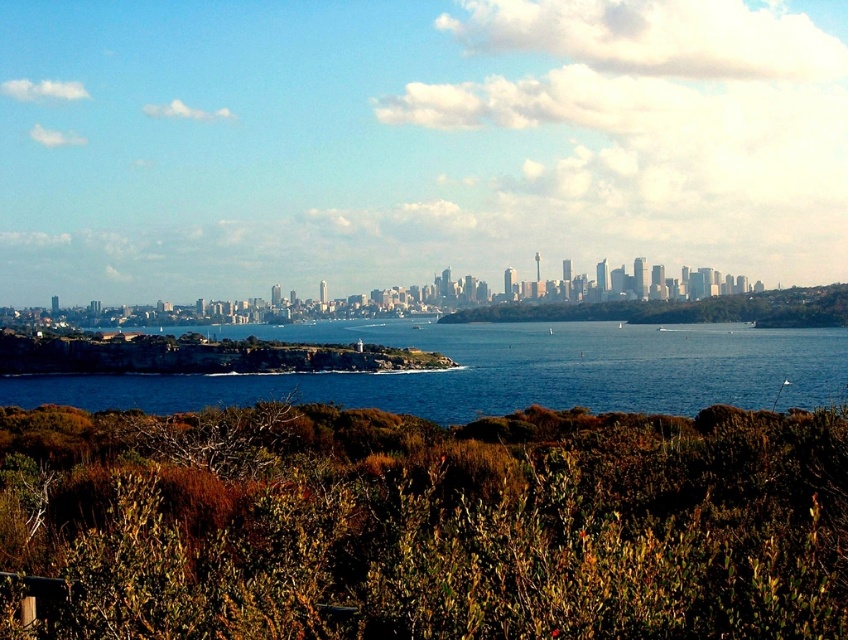
Who is positioned more to the right, green shrubbery at lower center or green leafy shrubs at center?

green leafy shrubs at center is more to the right.

Can you confirm if green shrubbery at lower center is positioned to the left of green leafy shrubs at center?

Correct, you'll find green shrubbery at lower center to the left of green leafy shrubs at center.

Which is in front, point (472, 545) or point (767, 301)?

Point (472, 545) is more forward.

The width and height of the screenshot is (848, 640). I want to click on green shrubbery at lower center, so click(x=424, y=524).

Is blue water at center bigger than green leafy shrubs at center?

Yes.

Based on the photo, is blue water at center shorter than green leafy shrubs at center?

No.

I want to click on blue water at center, so click(x=501, y=371).

The image size is (848, 640). Find the location of `blue water at center`. blue water at center is located at coordinates (501, 371).

Which of these two, green shrubbery at lower center or blue water at center, stands taller?

blue water at center

Who is positioned more to the left, green shrubbery at lower center or blue water at center?

From the viewer's perspective, blue water at center appears more on the left side.

This screenshot has height=640, width=848. What do you see at coordinates (424, 524) in the screenshot? I see `green shrubbery at lower center` at bounding box center [424, 524].

Identify the location of green shrubbery at lower center. (424, 524).